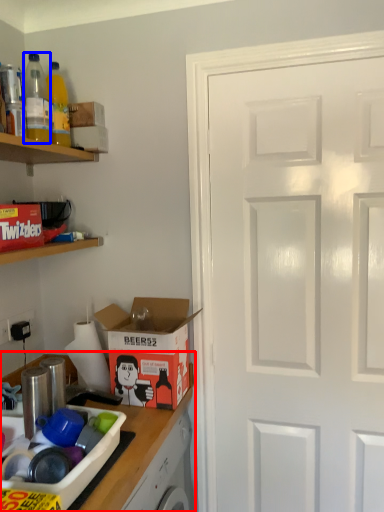
Question: Among these objects, which one is nearest to the camera, countertop (highlighted by a red box) or bottle (highlighted by a blue box)?

Choices:
 (A) countertop
 (B) bottle

Answer: (A)